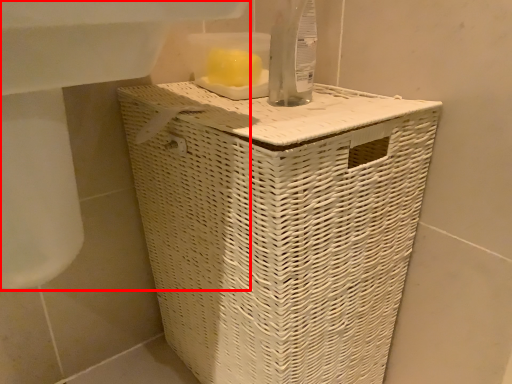
Question: Observing the image, what is the correct spatial positioning of sink (annotated by the red box) in reference to waste container?

Choices:
 (A) right
 (B) left

Answer: (B)